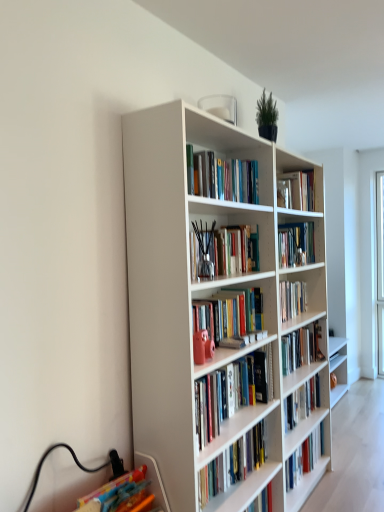
Question: Which direction should I rotate to face translucent glass vase at center, the 2th book in the bottom-to-top sequence, — up or down?

Choices:
 (A) down
 (B) up

Answer: (B)

Question: Is translucent glass vase at center, which is counted as the third book, starting from the top, completely or partially outside of hardcover book at upper center, the 1th book viewed from the top?

Choices:
 (A) yes
 (B) no

Answer: (A)

Question: Is translucent glass vase at center, the 2th book in the bottom-to-top sequence, shorter than hardcover book at upper center, the 1th book viewed from the top?

Choices:
 (A) no
 (B) yes

Answer: (B)

Question: Does translucent glass vase at center, the 2th book in the bottom-to-top sequence, have a smaller size compared to hardcover book at upper center, the 1th book viewed from the top?

Choices:
 (A) no
 (B) yes

Answer: (A)

Question: Is translucent glass vase at center, which is counted as the third book, starting from the top, facing away from hardcover book at upper center, which appears as the fourth book when ordered from the bottom?

Choices:
 (A) yes
 (B) no

Answer: (B)

Question: From the image's perspective, is translucent glass vase at center, which is counted as the third book, starting from the top, above hardcover book at upper center, the 1th book viewed from the top?

Choices:
 (A) yes
 (B) no

Answer: (B)

Question: Is translucent glass vase at center, the 2th book in the bottom-to-top sequence, not near hardcover book at upper center, the 1th book viewed from the top?

Choices:
 (A) no
 (B) yes

Answer: (A)

Question: Is white matte bookcase at center at the right side of white glossy bookshelf at center, arranged as the 1th book when ordered from the bottom?

Choices:
 (A) yes
 (B) no

Answer: (A)

Question: Can you confirm if white matte bookcase at center is smaller than white glossy bookshelf at center, which is the 4th book in top-to-bottom order?

Choices:
 (A) no
 (B) yes

Answer: (A)

Question: Is white matte bookcase at center looking in the opposite direction of white glossy bookshelf at center, arranged as the 1th book when ordered from the bottom?

Choices:
 (A) no
 (B) yes

Answer: (B)

Question: From the image's perspective, would you say white matte bookcase at center is shown under white glossy bookshelf at center, arranged as the 1th book when ordered from the bottom?

Choices:
 (A) yes
 (B) no

Answer: (B)

Question: Does white matte bookcase at center touch white glossy bookshelf at center, which is the 4th book in top-to-bottom order?

Choices:
 (A) yes
 (B) no

Answer: (B)

Question: Can we say white matte bookcase at center lies outside white glossy bookshelf at center, which is the 4th book in top-to-bottom order?

Choices:
 (A) no
 (B) yes

Answer: (B)

Question: Considering the relative sizes of white matte bookcase at center and hardcover books at upper center, which is counted as the third book, starting from the bottom, in the image provided, is white matte bookcase at center taller than hardcover books at upper center, which is counted as the third book, starting from the bottom,?

Choices:
 (A) yes
 (B) no

Answer: (A)